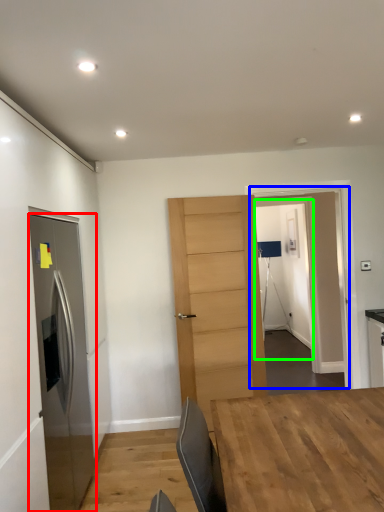
Question: Which object is positioned closest to door (highlighted by a red box)? Select from glass door (highlighted by a blue box) and glass door (highlighted by a green box).

Choices:
 (A) glass door
 (B) glass door

Answer: (A)